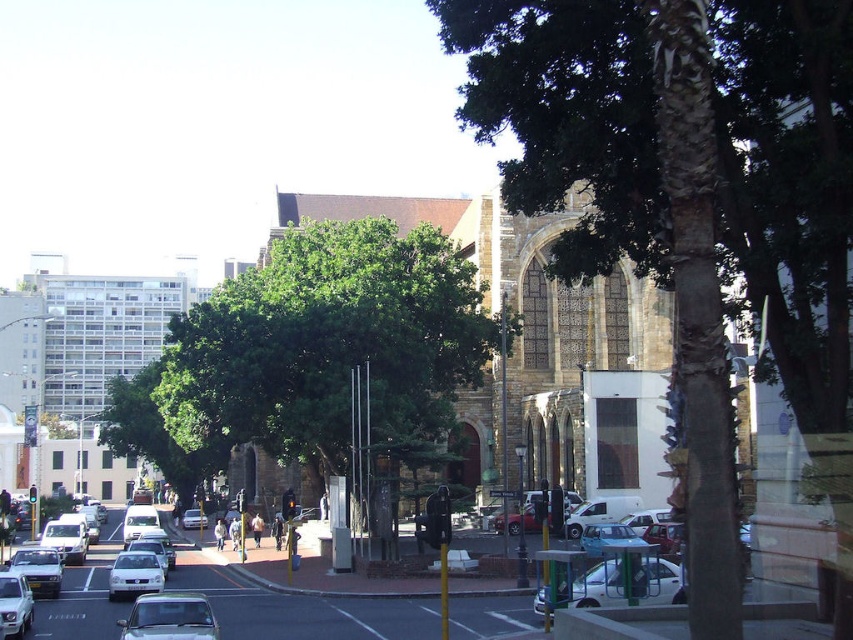
You are standing at the camera position and want to reach the point at coordinates (415, 300). The maximum distance you can walk is 100 meters. Can you safely reach that point?

The point at coordinates (415, 300) is 88.58 meters from the camera, so yes, you can safely reach it since it is within the 100 meter limit.

You are a delivery person who needs to park your metallic silver car at center in a spot that can accommodate its width. The parking spot you found is designed for vehicles up to the width of the brown stone church at center. Can your car fit into this spot?

The brown stone church at center might be wider than metallic silver car at center, so the parking spot designed for the church width can accommodate the metallic silver car at center.

You are standing on the sidewalk in this urban street scene. You want to take a photo of the brown stone church at center. Considering your current position, will the church fit entirely within the frame of a standard smartphone camera with a 78.6 degree field of view? Please explain your reasoning.

The brown stone church at center is 232.44 feet away from the viewer. To determine if it fits in the frame, we calculate the maximum width the camera can capture at that distance. Using the formula width at distance d is 2 x d x tan FOV angle over 2. Plugging in the numbers, 2 x 232.44 x tan 78.6 divided by 2. The calculation shows the maximum width is approximately 232.44 x 2 x tan 39.3 degrees. However, without knowing the actual width of the church, we cannot confirm if it fits. The given information is